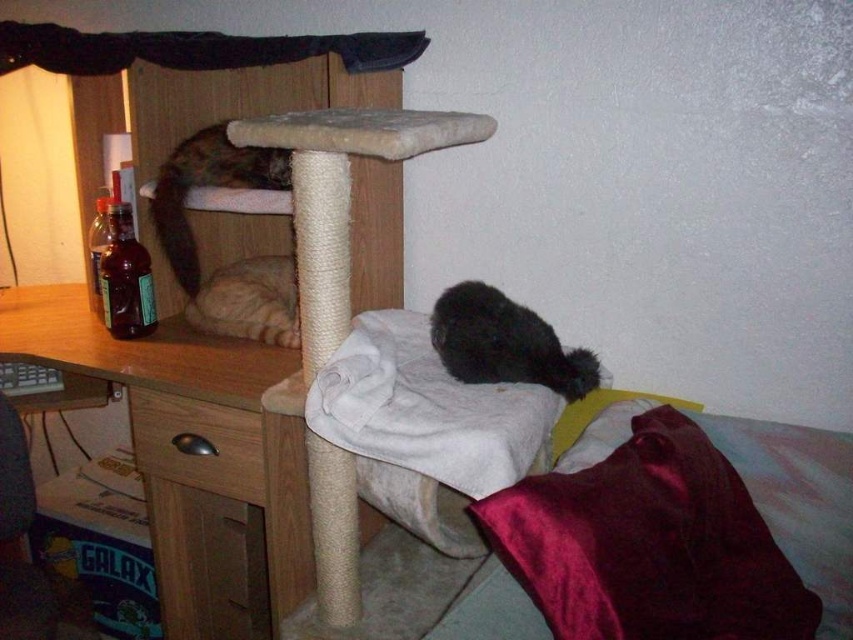
You are a cat owner who wants to place a new toy between the black fuzzy cat at center and the tabby fur cat at upper left. Which cat should you position the toy closer to if you want it to be on the left side of the two?

You should position the toy closer to the tabby fur cat at upper left because the black fuzzy cat at center is to the right of the tabby fur cat at upper left, so the tabby fur cat at upper left is on the left side.

You are a cat owner who wants to move your cat from the wooden desk at left to the black fuzzy cat at center. Which direction should you move the cat?

The wooden desk at left is to the left of the black fuzzy cat at center, so you should move the cat to the right to reach the black fuzzy cat at center.